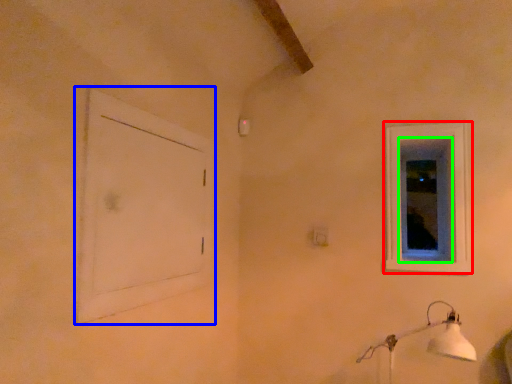
Question: Which object is positioned closest to window (highlighted by a red box)? Select from window frame (highlighted by a blue box) and window screen (highlighted by a green box).

Choices:
 (A) window frame
 (B) window screen

Answer: (B)